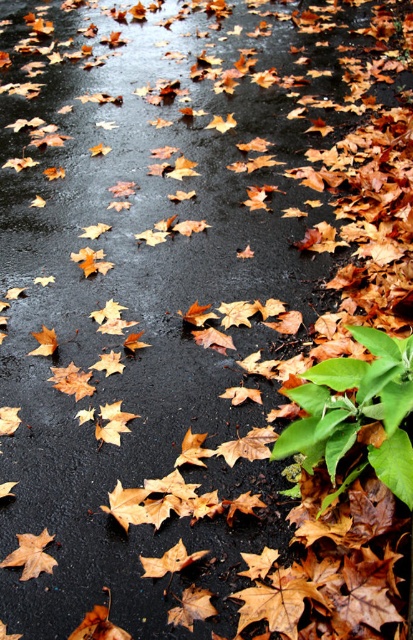
Question: Observing the image, what is the correct spatial positioning of orange matte maple leaf at lower left in reference to orange matte maple leaf at center?

Choices:
 (A) right
 (B) left

Answer: (B)

Question: Which object appears farthest from the camera in this image?

Choices:
 (A) brown matte maple leaf at lower center
 (B) orange matte maple leaf at lower left
 (C) brown matte maple leaf at lower left
 (D) orange matte maple leaf at center

Answer: (B)

Question: Can you confirm if brown matte maple leaf at lower left is thinner than orange matte maple leaf at lower left?

Choices:
 (A) yes
 (B) no

Answer: (B)

Question: Which of these objects is positioned farthest from the orange matte maple leaf at center?

Choices:
 (A) brown matte maple leaf at lower center
 (B) brown matte maple leaf at lower left
 (C) orange matte maple leaf at lower left

Answer: (B)

Question: Which point is closer to the camera?

Choices:
 (A) (163, 561)
 (B) (47, 561)
 (C) (114, 486)
 (D) (287, 620)

Answer: (D)

Question: Does brown matte maple leaf at lower center have a smaller size compared to orange matte maple leaf at center?

Choices:
 (A) yes
 (B) no

Answer: (B)